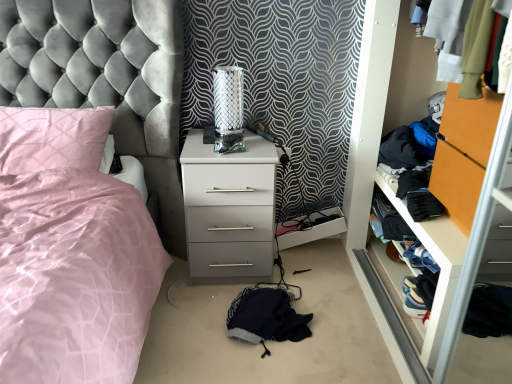
Identify the location of blank space above denim fabric clothes at right (from a real-world perspective). (434, 223).